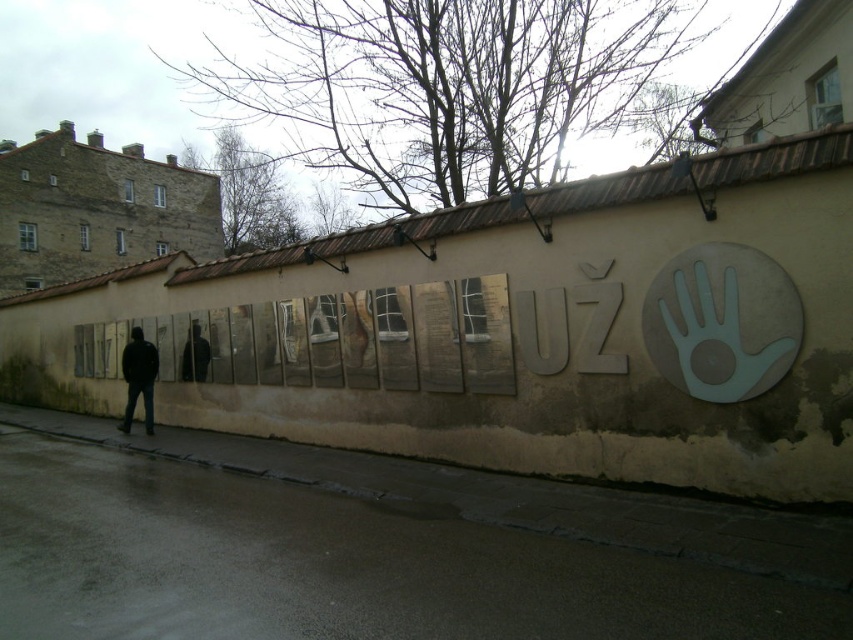
In the scene shown: You are a photographer trying to capture both the matte gray letters at center and the dark blue jeans at left in a single frame. Based on their sizes, which object should you focus on first to ensure both are in focus?

The matte gray letters at center has a smaller size compared to dark blue jeans at left, so you should focus on the dark blue jeans at left first to ensure both are in focus.

You are a fashion designer observing the outdoor scene. You see the dark blue jeans at left and the black matte jacket at center. Which item of clothing has a greater width?

The dark blue jeans at left has a greater width than the black matte jacket at center according to the description.

You are standing in front of the beige wall with reflective panels and want to read the matte gray letters at center clearly. Considering the distance between you and the letters, can you estimate how far you need to move closer to ensure the text becomes legible?

The matte gray letters at center are 6.82 meters away from the camera. To ensure legibility, you should move closer until the distance is within a comfortable reading range, typically around 0.3 to 0.5 meters. This means moving approximately 6.52 to 6.57 meters closer.